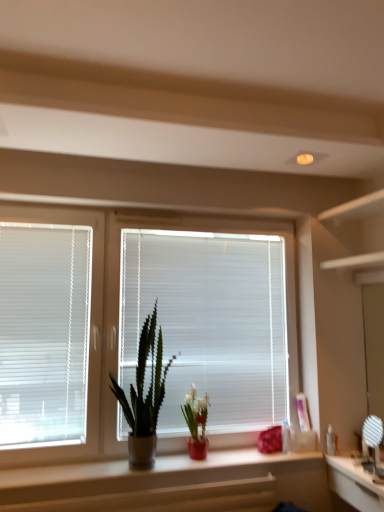
Where is `vacant area that is in front of clear plastic bottle at right, the first toiletry positioned from the right`? vacant area that is in front of clear plastic bottle at right, the first toiletry positioned from the right is located at coordinates (348, 464).